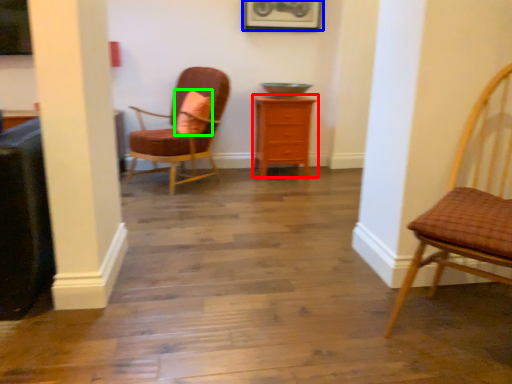
Question: Based on their relative distances, which object is nearer to chest of drawers (highlighted by a red box)? Choose from picture frame (highlighted by a blue box) and pillow (highlighted by a green box).

Choices:
 (A) picture frame
 (B) pillow

Answer: (B)